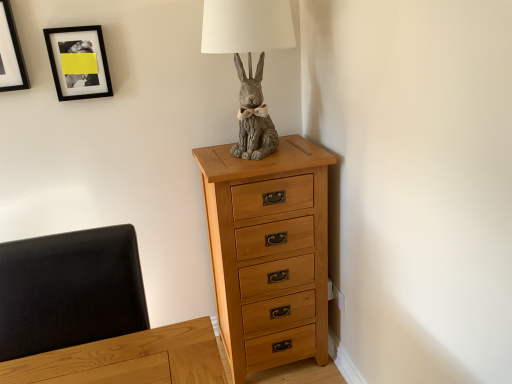
Question: Visually, is black leather swivel chair at left positioned to the left or to the right of gray stone rabbit at center?

Choices:
 (A) right
 (B) left

Answer: (B)

Question: Which is correct: black leather swivel chair at left is inside gray stone rabbit at center, or outside of it?

Choices:
 (A) outside
 (B) inside

Answer: (A)

Question: Based on their relative distances, which object is farther from the gray stone rabbit at center?

Choices:
 (A) natural wood chest of drawers at center
 (B) black leather swivel chair at left
 (C) black matte picture frame at upper left, the 1th picture frame from the right
 (D) matte black picture frame at upper left, arranged as the second picture frame when viewed from the right

Answer: (B)

Question: Which object is positioned farthest from the gray stone rabbit at center?

Choices:
 (A) black leather swivel chair at left
 (B) matte black picture frame at upper left, arranged as the second picture frame when viewed from the right
 (C) natural wood chest of drawers at center
 (D) black matte picture frame at upper left, which is counted as the second picture frame, starting from the left

Answer: (A)